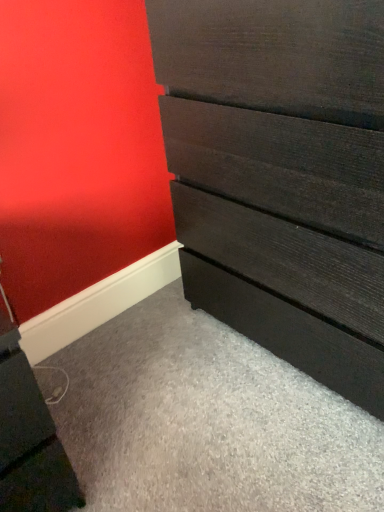
Describe the element at coordinates (29, 438) in the screenshot. I see `matte black file cabinet at lower left` at that location.

The image size is (384, 512). Find the location of `matte black file cabinet at lower left`. matte black file cabinet at lower left is located at coordinates (29, 438).

What is the approximate width of matte black file cabinet at lower left?

The width of matte black file cabinet at lower left is 52.51 centimeters.

At what (x,y) coordinates should I click in order to perform the action: click on dark wood chest of drawers at center. Please return your answer as a coordinate pair (x, y). Looking at the image, I should click on (281, 175).

This screenshot has width=384, height=512. Describe the element at coordinates (281, 175) in the screenshot. I see `dark wood chest of drawers at center` at that location.

What are the coordinates of `matte black file cabinet at lower left` in the screenshot? It's located at (29, 438).

Which object is positioned more to the right, dark wood chest of drawers at center or matte black file cabinet at lower left?

dark wood chest of drawers at center.

Who is more distant, dark wood chest of drawers at center or matte black file cabinet at lower left?

matte black file cabinet at lower left is behind.

Which is farther, (368,113) or (36,424)?

Point (36,424)

From the image's perspective, which object appears higher, dark wood chest of drawers at center or matte black file cabinet at lower left?

dark wood chest of drawers at center, from the image's perspective.

In the scene shown: From a real-world perspective, which is physically above, dark wood chest of drawers at center or matte black file cabinet at lower left?

dark wood chest of drawers at center is physically above.

Between dark wood chest of drawers at center and matte black file cabinet at lower left, which one has smaller width?

Thinner between the two is matte black file cabinet at lower left.

Can you confirm if dark wood chest of drawers at center is shorter than matte black file cabinet at lower left?

In fact, dark wood chest of drawers at center may be taller than matte black file cabinet at lower left.

Considering the sizes of objects dark wood chest of drawers at center and matte black file cabinet at lower left in the image provided, who is smaller, dark wood chest of drawers at center or matte black file cabinet at lower left?

Smaller between the two is matte black file cabinet at lower left.

Is matte black file cabinet at lower left completely or partially inside dark wood chest of drawers at center?

That's incorrect, matte black file cabinet at lower left is not inside dark wood chest of drawers at center.

Are dark wood chest of drawers at center and matte black file cabinet at lower left located far from each other?

No, dark wood chest of drawers at center is not far away from matte black file cabinet at lower left.

Is dark wood chest of drawers at center aimed at matte black file cabinet at lower left?

Yes, dark wood chest of drawers at center faces towards matte black file cabinet at lower left.

In order to click on file cabinet below the dark wood chest of drawers at center (from a real-world perspective) in this screenshot , I will do `click(29, 438)`.

Is matte black file cabinet at lower left to the right of dark wood chest of drawers at center from the viewer's perspective?

No.

Does matte black file cabinet at lower left lie behind dark wood chest of drawers at center?

Yes, the depth of matte black file cabinet at lower left is greater than that of dark wood chest of drawers at center.

Is point (48, 466) positioned before point (327, 123)?

No, it is behind (327, 123).

From the image's perspective, is matte black file cabinet at lower left located above or below dark wood chest of drawers at center?

From the image's perspective, matte black file cabinet at lower left appears below dark wood chest of drawers at center.

From a real-world perspective, which is physically above, matte black file cabinet at lower left or dark wood chest of drawers at center?

dark wood chest of drawers at center.

From the picture: Can you confirm if matte black file cabinet at lower left is thinner than dark wood chest of drawers at center?

Correct, the width of matte black file cabinet at lower left is less than that of dark wood chest of drawers at center.

Is matte black file cabinet at lower left taller than dark wood chest of drawers at center?

No.

Who is smaller, matte black file cabinet at lower left or dark wood chest of drawers at center?

Smaller between the two is matte black file cabinet at lower left.

Can we say matte black file cabinet at lower left lies outside dark wood chest of drawers at center?

Yes, matte black file cabinet at lower left is located beyond the bounds of dark wood chest of drawers at center.

Is the surface of matte black file cabinet at lower left in direct contact with dark wood chest of drawers at center?

No, matte black file cabinet at lower left is not next to dark wood chest of drawers at center.

Is matte black file cabinet at lower left turned away from dark wood chest of drawers at center?

matte black file cabinet at lower left is not turned away from dark wood chest of drawers at center.

How many degrees apart are the facing directions of matte black file cabinet at lower left and dark wood chest of drawers at center?

90.7 degrees separate the facing orientations of matte black file cabinet at lower left and dark wood chest of drawers at center.

Locate an element on the screen. The width and height of the screenshot is (384, 512). file cabinet lying behind the dark wood chest of drawers at center is located at coordinates (29, 438).

Locate an element on the screen. The image size is (384, 512). chest of drawers in front of the matte black file cabinet at lower left is located at coordinates (281, 175).

What are the coordinates of `file cabinet located underneath the dark wood chest of drawers at center (from a real-world perspective)` in the screenshot? It's located at (29, 438).